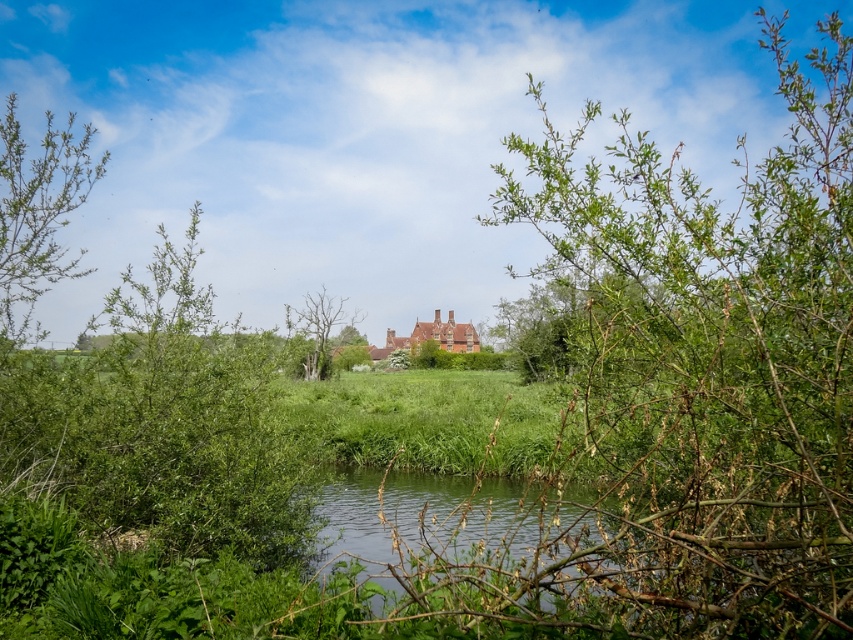
Does green leafy bush at left appear over bare wood tree at center?

Yes.

Based on the photo, which is more to the right, green leafy bush at left or bare wood tree at center?

Positioned to the right is green leafy bush at left.

Who is more forward, (x=38, y=161) or (x=321, y=348)?

Point (x=38, y=161) is more forward.

Where is `green leafy bush at left`? The height and width of the screenshot is (640, 853). green leafy bush at left is located at coordinates (38, 218).